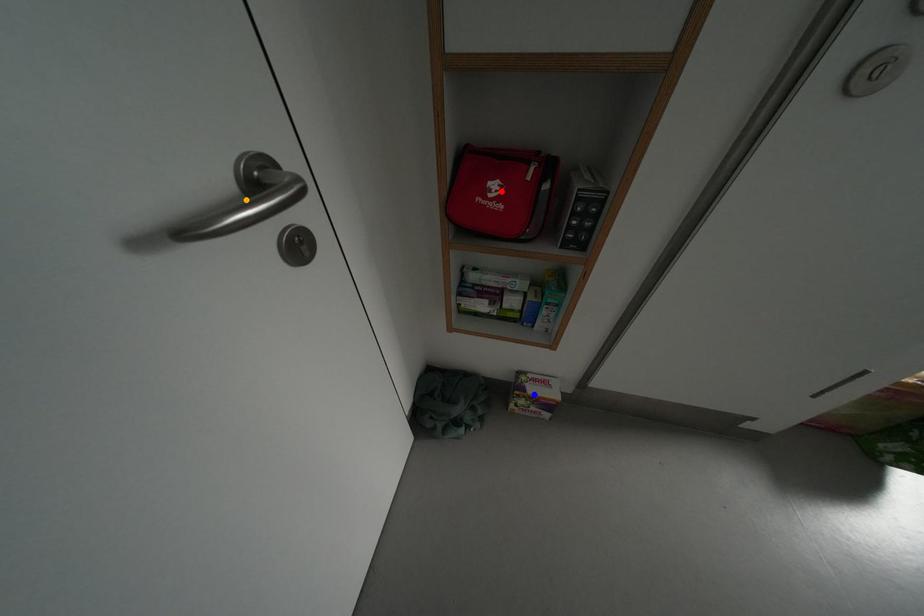
Order these from farthest to nearest:
red point | orange point | blue point

blue point → red point → orange point